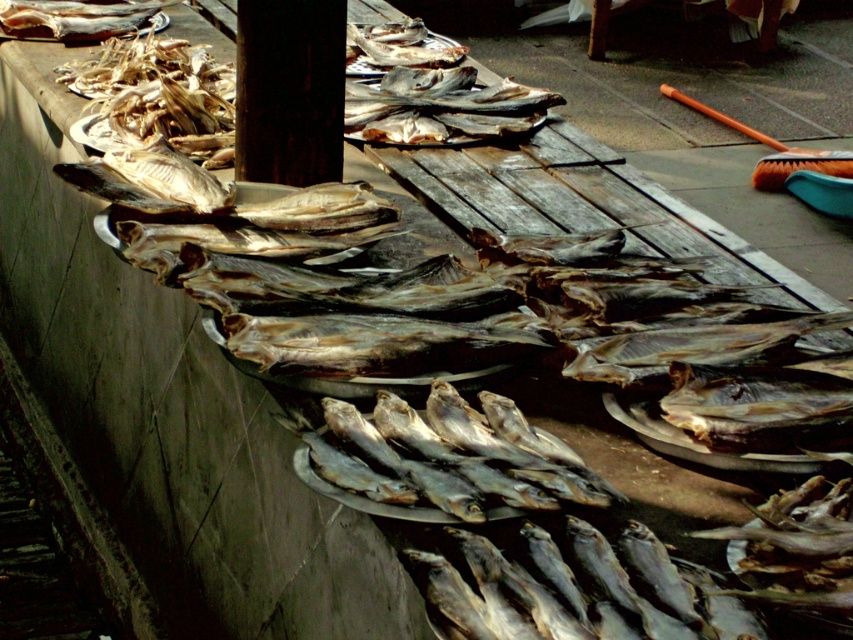
Question: Is dried silver fish at center above shiny silver fish at upper left?

Choices:
 (A) yes
 (B) no

Answer: (B)

Question: Which of the following is the closest to the observer?

Choices:
 (A) dried silver fish at center
 (B) shiny silver fish at upper left

Answer: (A)

Question: Does dried silver fish at center have a greater width compared to shiny silver fish at upper left?

Choices:
 (A) no
 (B) yes

Answer: (B)

Question: Which point is closer to the camera?

Choices:
 (A) shiny silver fish at upper left
 (B) dried silver fish at center

Answer: (B)

Question: Which point is farther from the camera taking this photo?

Choices:
 (A) (142, 12)
 (B) (397, 348)

Answer: (A)

Question: Can you confirm if dried silver fish at center is positioned to the left of shiny silver fish at upper left?

Choices:
 (A) no
 (B) yes

Answer: (A)